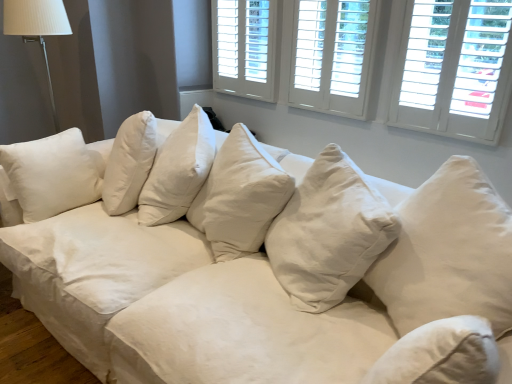
Question: From a real-world perspective, is white fabric lampshade at upper left positioned under white wood shutters at upper right, arranged as the 1th window when viewed from the right, based on gravity?

Choices:
 (A) no
 (B) yes

Answer: (B)

Question: From the image's perspective, does white fabric lampshade at upper left appear higher than white wood shutters at upper right, arranged as the third window when viewed from the left?

Choices:
 (A) no
 (B) yes

Answer: (B)

Question: Is white fabric lampshade at upper left looking in the opposite direction of white wood shutters at upper right, arranged as the third window when viewed from the left?

Choices:
 (A) yes
 (B) no

Answer: (B)

Question: Is white fabric lampshade at upper left not inside white wood shutters at upper right, arranged as the third window when viewed from the left?

Choices:
 (A) yes
 (B) no

Answer: (A)

Question: Is white fabric lampshade at upper left with white wood shutters at upper right, arranged as the third window when viewed from the left?

Choices:
 (A) no
 (B) yes

Answer: (A)

Question: Considering the relative sizes of white fabric lampshade at upper left and white wood shutters at upper right, arranged as the third window when viewed from the left, in the image provided, is white fabric lampshade at upper left thinner than white wood shutters at upper right, arranged as the third window when viewed from the left,?

Choices:
 (A) no
 (B) yes

Answer: (A)

Question: From the image's perspective, is white fabric lampshade at upper left above white wood shutters at upper center, placed as the 1th window when sorted from left to right?

Choices:
 (A) yes
 (B) no

Answer: (B)

Question: Are white fabric lampshade at upper left and white wood shutters at upper center, placed as the 1th window when sorted from left to right, beside each other?

Choices:
 (A) yes
 (B) no

Answer: (B)

Question: Is white wood shutters at upper center, which appears as the third window when viewed from the right, surrounded by white fabric lampshade at upper left?

Choices:
 (A) yes
 (B) no

Answer: (B)

Question: Is white fabric lampshade at upper left aimed at white wood shutters at upper center, which appears as the third window when viewed from the right?

Choices:
 (A) no
 (B) yes

Answer: (A)

Question: Can you confirm if white fabric lampshade at upper left is positioned to the right of white wood shutters at upper center, placed as the 1th window when sorted from left to right?

Choices:
 (A) yes
 (B) no

Answer: (B)

Question: From a real-world perspective, does white fabric lampshade at upper left sit lower than white wood shutters at upper center, placed as the 1th window when sorted from left to right?

Choices:
 (A) no
 (B) yes

Answer: (B)

Question: Is white wood shutters at upper right, arranged as the third window when viewed from the left, taller than white fabric lampshade at upper left?

Choices:
 (A) no
 (B) yes

Answer: (A)